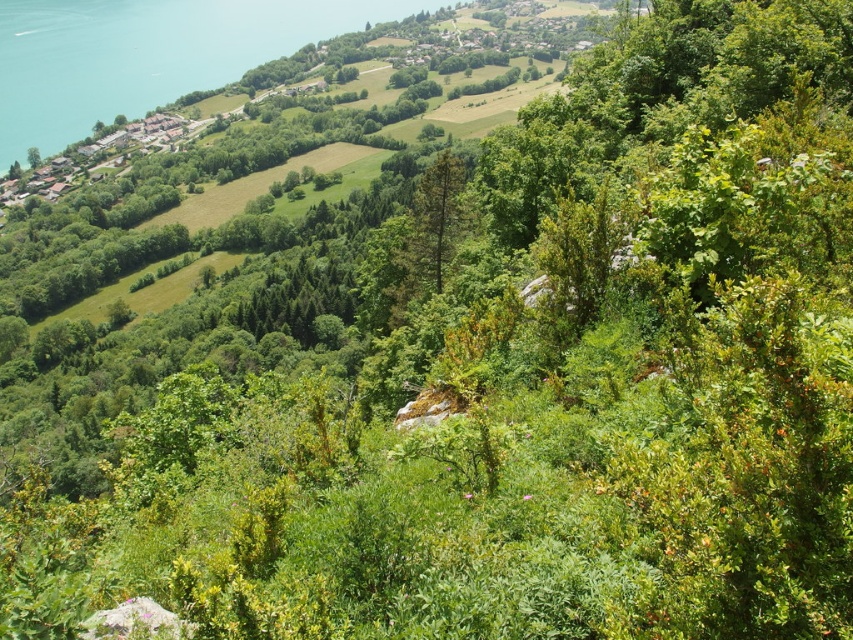
Which is below, green water at left or green matte tree at center?

green matte tree at center

Does green water at left have a larger size compared to green matte tree at center?

Yes, green water at left is bigger than green matte tree at center.

Between point (77, 16) and point (451, 156), which one is positioned in front?

Point (451, 156) is in front.

Where is `green water at left`? green water at left is located at coordinates (146, 54).